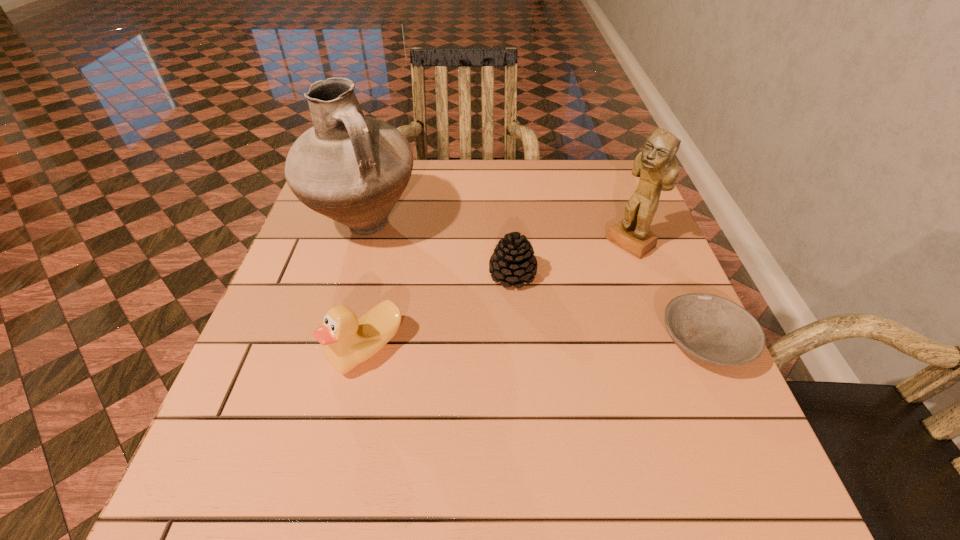
Identify the location of pitcher situated at the left edge. (351, 168).

Locate an element on the screen. Image resolution: width=960 pixels, height=540 pixels. bowl present at the right edge is located at coordinates (711, 329).

Where is `figurine that is at the right edge`? The width and height of the screenshot is (960, 540). figurine that is at the right edge is located at coordinates (658, 170).

Where is `object present at the far left corner`? This screenshot has height=540, width=960. object present at the far left corner is located at coordinates (351, 168).

Where is `free space at the far edge of the desktop`? This screenshot has width=960, height=540. free space at the far edge of the desktop is located at coordinates (540, 160).

At what (x,y) coordinates should I click in order to perform the action: click on vacant region at the near edge of the desktop. Please return your answer as a coordinate pair (x, y). Image resolution: width=960 pixels, height=540 pixels. Looking at the image, I should click on (581, 417).

Where is `vacant space at the right edge of the desktop`? vacant space at the right edge of the desktop is located at coordinates click(x=592, y=209).

Where is `free space at the near left corner of the desktop`? This screenshot has height=540, width=960. free space at the near left corner of the desktop is located at coordinates (277, 440).

The image size is (960, 540). In the image, there is a desktop. Find the location of `vacant area at the far right corner`. vacant area at the far right corner is located at coordinates (616, 179).

Locate an element on the screen. vacant space at the near right corner of the desktop is located at coordinates (744, 437).